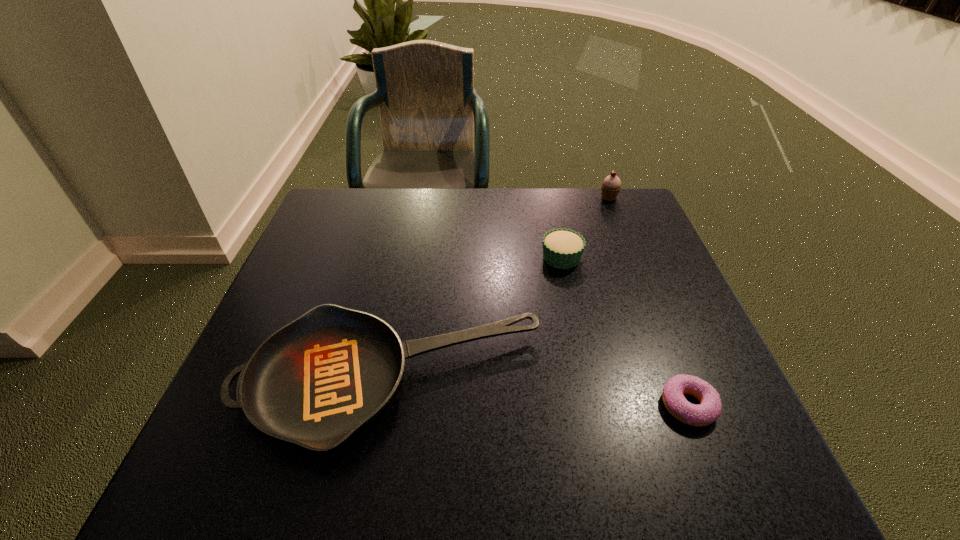
You are a GUI agent. You are given a task and a screenshot of the screen. Output one action in this format:
    pyautogui.click(x=<x>, y=<y>)
    Task: Click on the vacant area situated 0.210m on the back of the shortest object
    The image size is (960, 540).
    Given the screenshot: What is the action you would take?
    pyautogui.click(x=648, y=302)

Where is `object located at the far edge`? object located at the far edge is located at coordinates tap(611, 185).

Find the location of a particular element. Image resolution: width=960 pixels, height=540 pixels. object located in the near edge section of the desktop is located at coordinates (322, 377).

Locate an element on the screen. The image size is (960, 540). object that is at the left edge is located at coordinates (322, 377).

Find the location of a particular element. This screenshot has height=540, width=960. cupcake present at the right edge is located at coordinates (611, 185).

This screenshot has width=960, height=540. I want to click on doughnut that is at the right edge, so click(x=709, y=409).

You are a GUI agent. You are given a task and a screenshot of the screen. Output one action in this format:
    pyautogui.click(x=<x>, y=<y>)
    Task: Click on the object positioned at the near left corner
    Image resolution: width=960 pixels, height=540 pixels.
    Given the screenshot: What is the action you would take?
    pyautogui.click(x=322, y=377)

Where is `object situated at the far right corner`? This screenshot has height=540, width=960. object situated at the far right corner is located at coordinates (611, 185).

The image size is (960, 540). What are the coordinates of `vacant space at the far edge` in the screenshot? It's located at (528, 198).

This screenshot has width=960, height=540. In order to click on vacant space at the near edge of the desktop in this screenshot , I will do `click(583, 451)`.